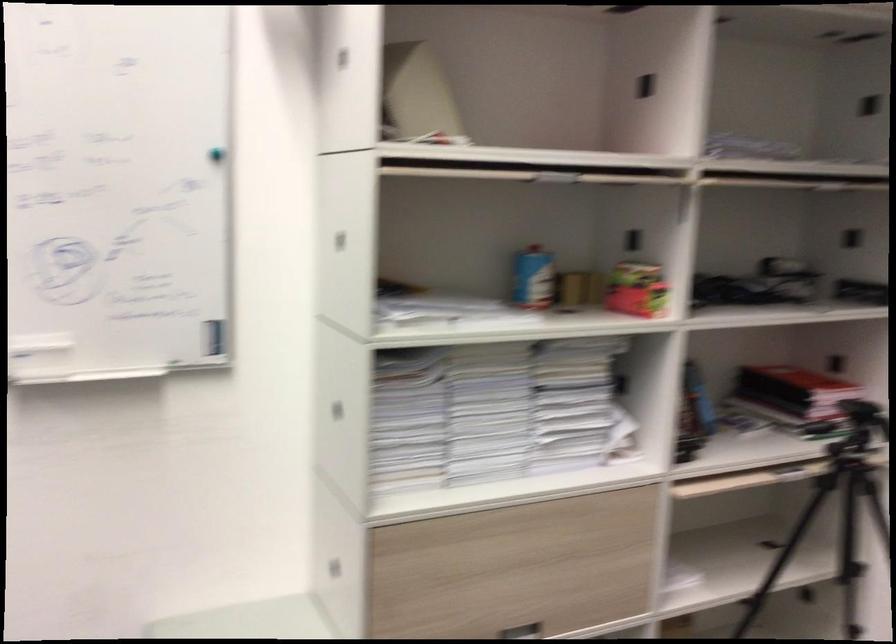
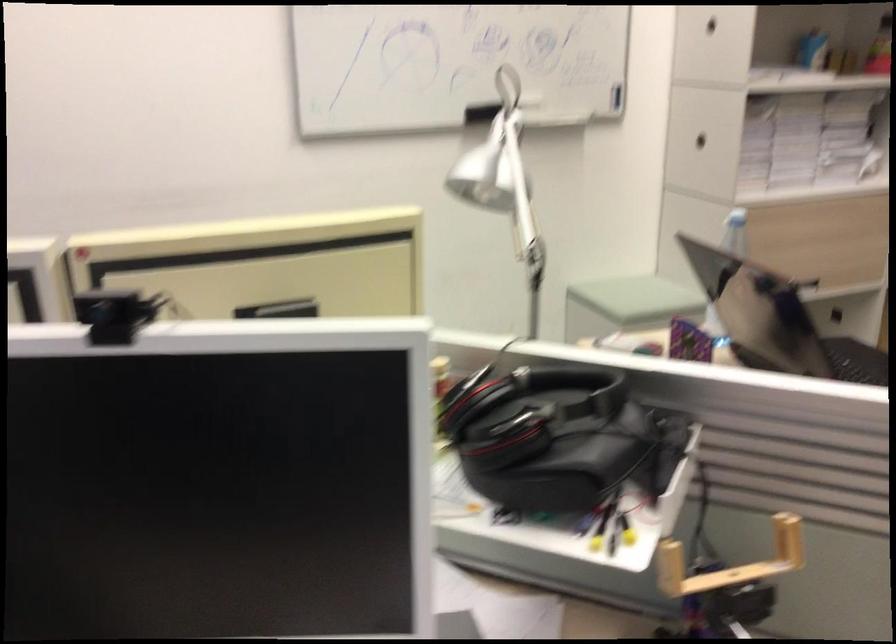
The point at (x=382, y=564) is marked in the first image. Where is the corresponding point in the second image?

(735, 232)